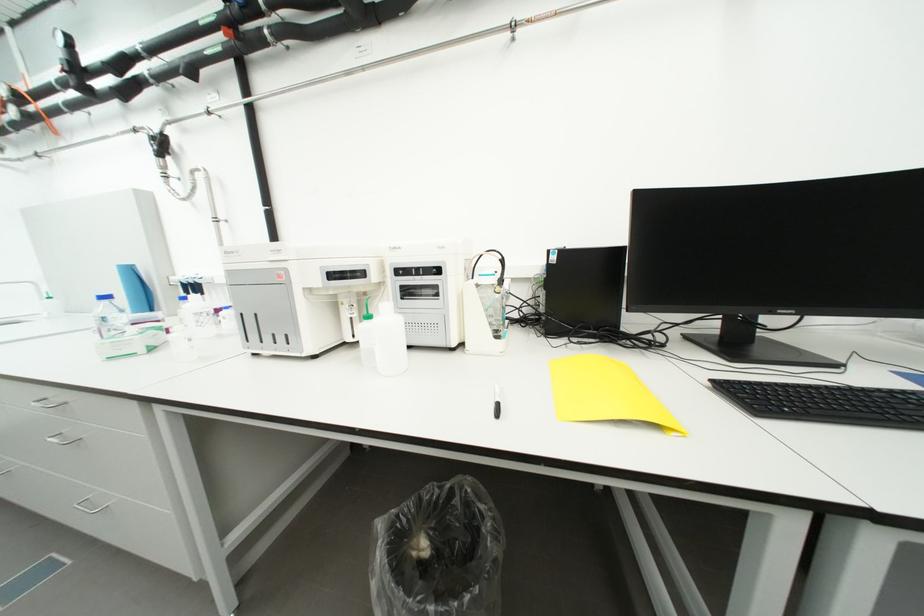
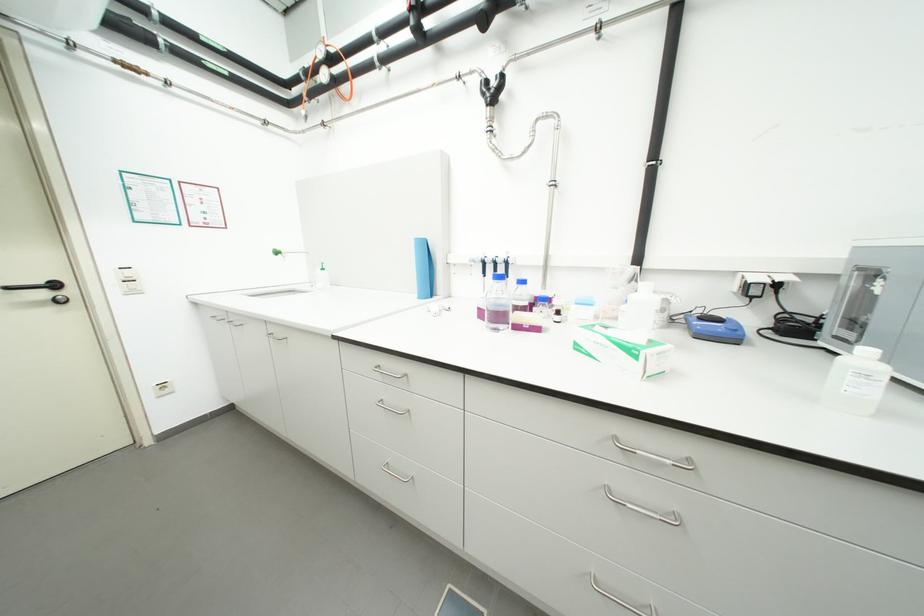
Question: What movement of the cameraman would produce the second image?

Choices:
 (A) Left
 (B) Right
 (C) Forward
 (D) Backward

Answer: (A)